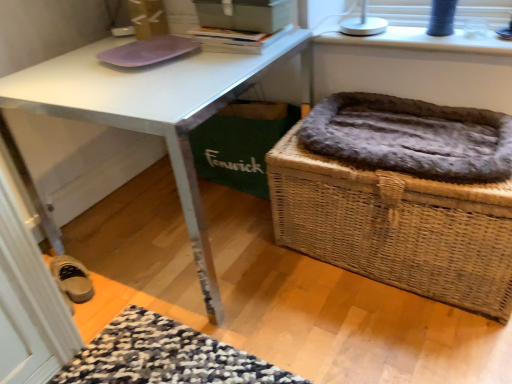
In order to click on free space to the left of fur-lined wicker basket at right in this screenshot , I will do `click(266, 314)`.